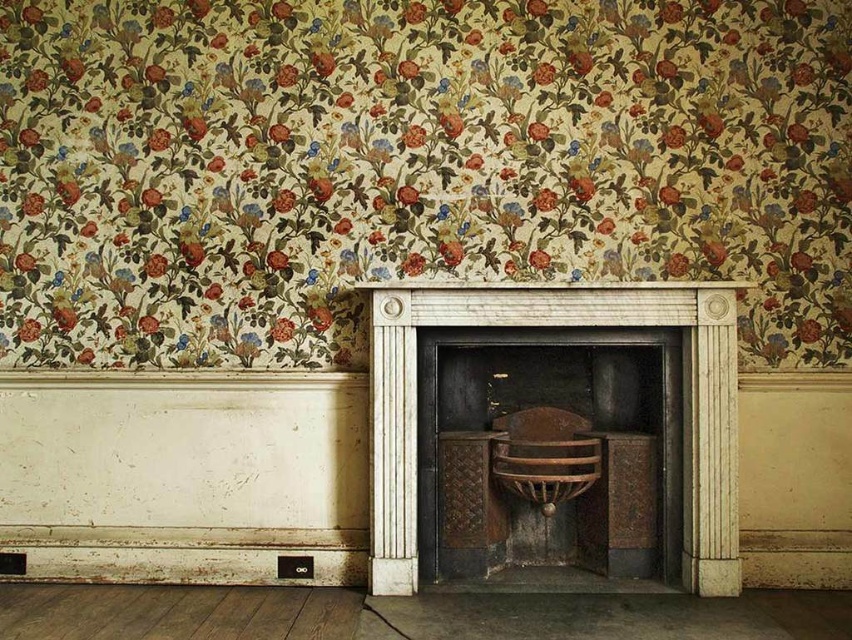
You are standing in the room and want to place a decorative item between the white marble fireplace at center and the wooden armchair at center. Based on their positions, which object should the decorative item be placed closer to?

The decorative item should be placed closer to the wooden armchair at center because the white marble fireplace at center is positioned on the left side of the wooden armchair at center, meaning the fireplace is to the left and the armchair is to the right. Therefore, the midpoint between them would be closer to the armchair.

You are an interior designer planning to hang a large painting that is 1.2 meters wide. The painting needs to be centered exactly between the top edge of the white marble fireplace at center and the bottom edge of the floral wallpaper above it. Can you determine if the available space between these two points is wide enough to fit the painting horizontally?

The position of white marble fireplace at center is at point (559, 326). However, without knowing the horizontal width between the top edge of the fireplace and the bottom edge of the floral wallpaper, it is impossible to determine if the space is wide enough for the painting. Additional measurements are required.